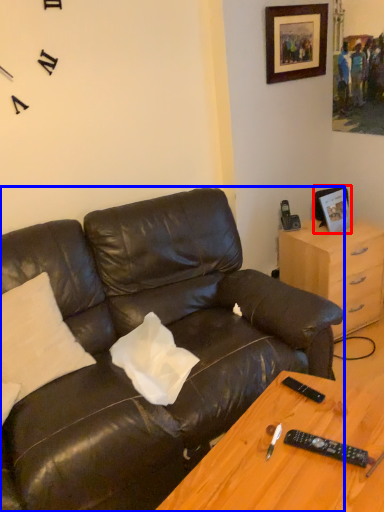
Question: Which of the following is the closest to the observer, picture frame (highlighted by a red box) or studio couch (highlighted by a blue box)?

Choices:
 (A) picture frame
 (B) studio couch

Answer: (B)